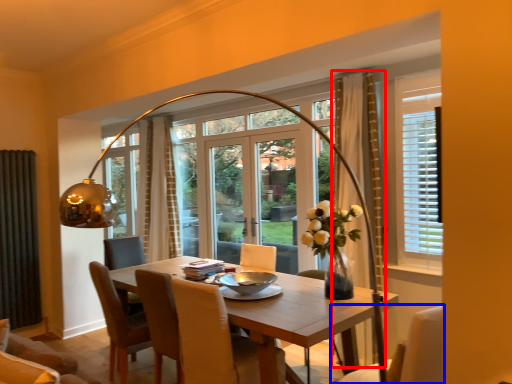
Question: Which point is closer to the camera, curtain (highlighted by a red box) or chair (highlighted by a blue box)?

Choices:
 (A) curtain
 (B) chair

Answer: (B)